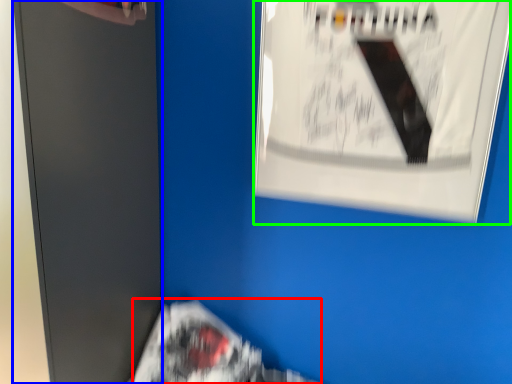
Question: Estimate the real-world distances between objects in this image. Which object is closer to flyer (highlighted by a red box), file cabinet (highlighted by a blue box) or poster (highlighted by a green box)?

Choices:
 (A) file cabinet
 (B) poster

Answer: (A)